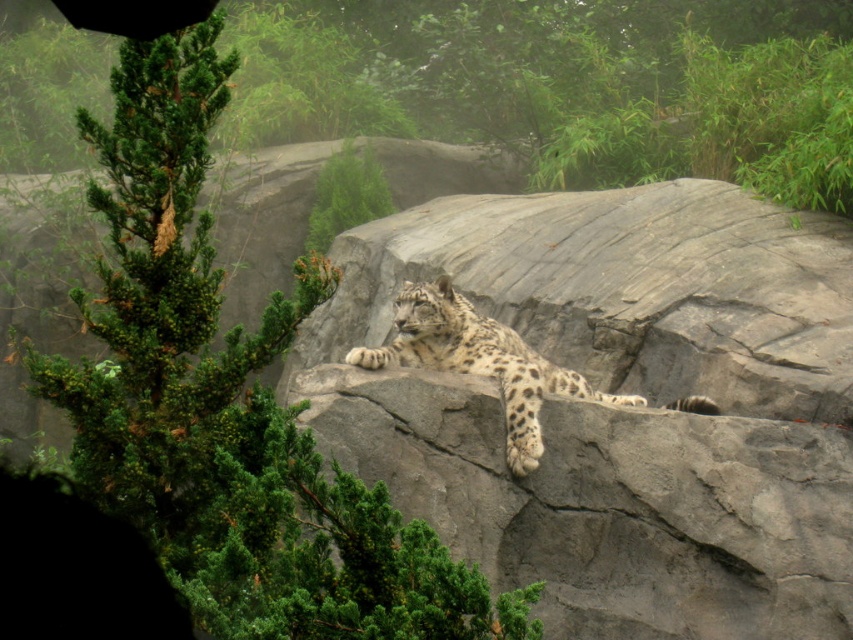
Question: Which object is closer to the camera taking this photo?

Choices:
 (A) spotted fur snow leopard at center
 (B) gray rough rock at center

Answer: (B)

Question: Is gray rough rock at center to the right of green textured pine tree at upper left from the viewer's perspective?

Choices:
 (A) yes
 (B) no

Answer: (A)

Question: Can you confirm if green textured pine tree at upper left is wider than spotted fur snow leopard at center?

Choices:
 (A) yes
 (B) no

Answer: (B)

Question: Which object is farther from the camera taking this photo?

Choices:
 (A) gray rough rock at center
 (B) spotted fur snow leopard at center

Answer: (B)

Question: Which point is closer to the camera taking this photo?

Choices:
 (A) (764, 481)
 (B) (113, 500)

Answer: (B)

Question: Can you confirm if gray rough rock at center is thinner than spotted fur snow leopard at center?

Choices:
 (A) no
 (B) yes

Answer: (B)